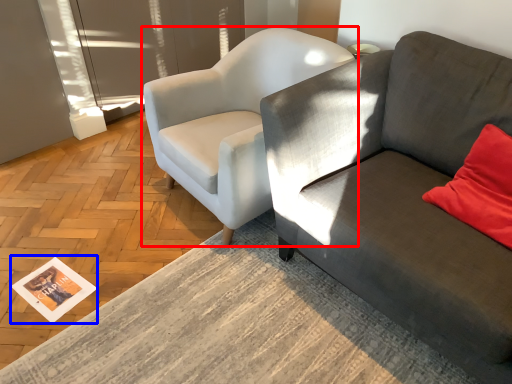
Question: Which of the following is the closest to the observer, chair (highlighted by a red box) or magazine (highlighted by a blue box)?

Choices:
 (A) chair
 (B) magazine

Answer: (A)